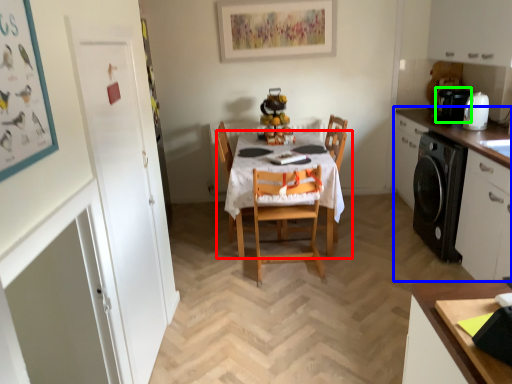
Question: Which is farther away from kitchen & dining room table (highlighted by a red box)? cabinetry (highlighted by a blue box) or coffee machine (highlighted by a green box)?

Choices:
 (A) cabinetry
 (B) coffee machine

Answer: (B)